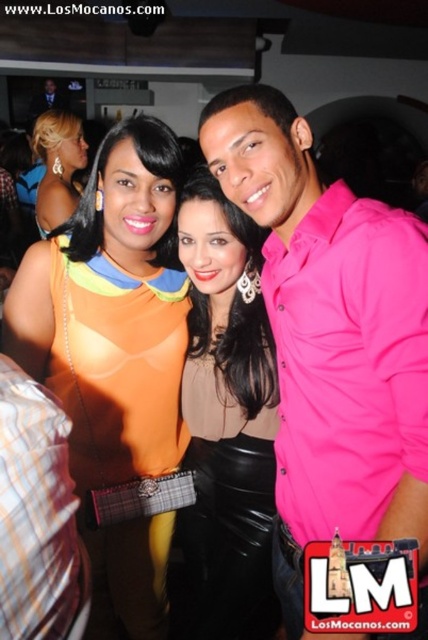
You are standing at the entrance of the venue and want to take a photo of the point at coordinates point [79,314]. The camera you have can focus on objects within 1.5 meters. Will the camera be able to capture the point clearly?

The distance between point [79,314] and the viewer is 1.34 meters, which is within the camera focus range of 1.5 meters. Therefore, the camera will be able to capture the point clearly.

You are at a party and see the matte black skirt at center and the plaid fabric shirt at left. Which clothing item is covering another?

The matte black skirt at center is positioned over the plaid fabric shirt at left, so the matte black skirt at center is covering the plaid fabric shirt at left.

You are a photographer at the event and want to adjust the camera focus to ensure both the matte black skirt at center and the plaid fabric shirt at left are clearly visible. Considering their sizes, which one might require a closer focus to capture details?

The matte black skirt at center is much taller than the plaid fabric shirt at left, so it might require a closer focus to capture details since it is larger in size.